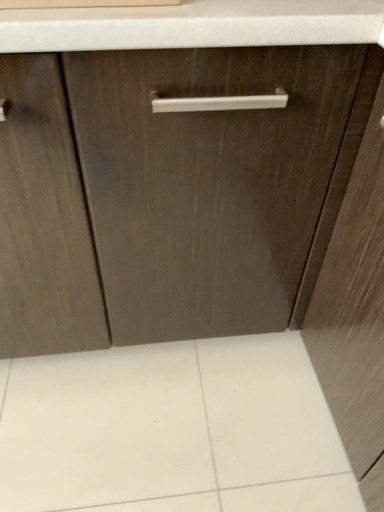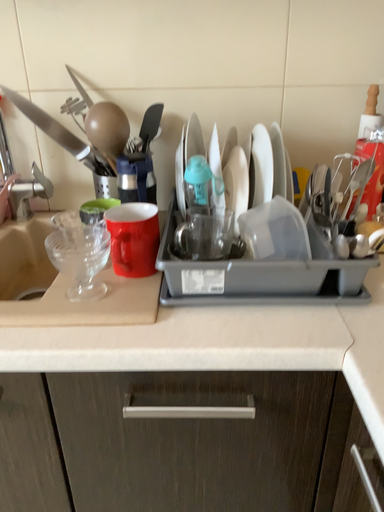
Question: Which way did the camera rotate in the video?

Choices:
 (A) rotated downward
 (B) rotated upward

Answer: (B)